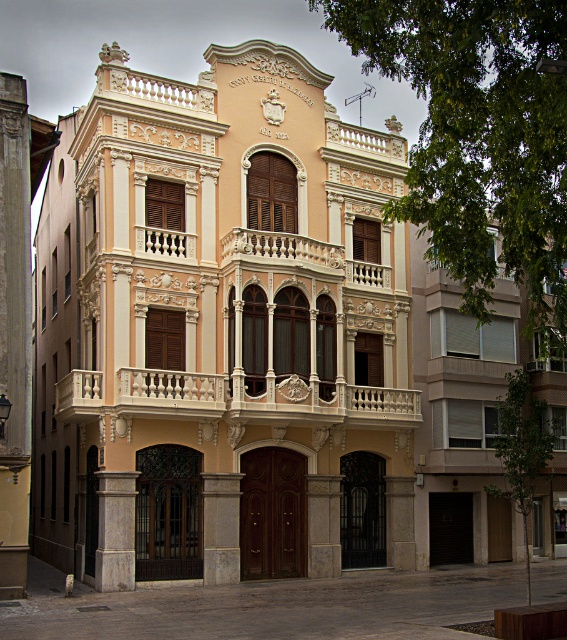
Is white marble balcony at center below white stone column at lower left?

Actually, white marble balcony at center is above white stone column at lower left.

Who is lower down, white marble balcony at center or white stone column at lower left?

Positioned lower is white stone column at lower left.

This screenshot has height=640, width=567. In order to click on white marble balcony at center in this screenshot , I will do `click(232, 400)`.

Does smooth stone pillar at center appear on the left side of gray stone pillar at center?

Yes, smooth stone pillar at center is to the left of gray stone pillar at center.

The image size is (567, 640). What do you see at coordinates (221, 528) in the screenshot? I see `smooth stone pillar at center` at bounding box center [221, 528].

The image size is (567, 640). Identify the location of smooth stone pillar at center. (221, 528).

Can you confirm if white marble balcony at center is thinner than smooth stone pillar at center?

In fact, white marble balcony at center might be wider than smooth stone pillar at center.

Does point (391, 404) come farther from viewer compared to point (234, 529)?

Yes, point (391, 404) is behind point (234, 529).

Where is `white marble balcony at center`? The height and width of the screenshot is (640, 567). white marble balcony at center is located at coordinates (232, 400).